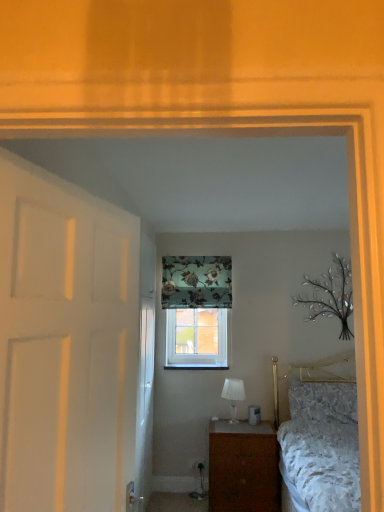
The width and height of the screenshot is (384, 512). I want to click on vacant region under white glass table lamp at center (from a real-world perspective), so click(228, 419).